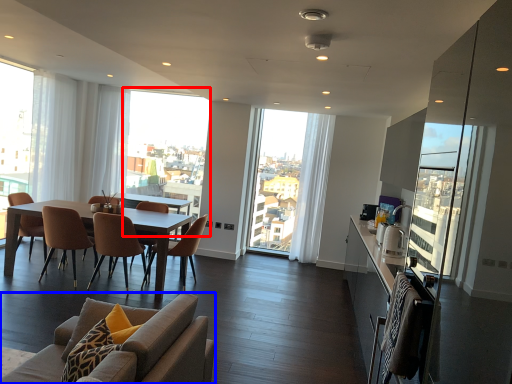
Question: Which object is closer to the camera taking this photo, window screen (highlighted by a red box) or chair (highlighted by a blue box)?

Choices:
 (A) window screen
 (B) chair

Answer: (B)